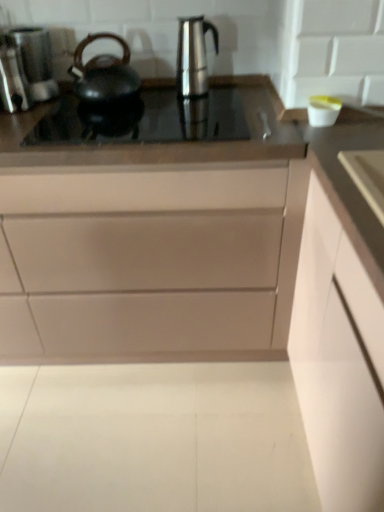
Question: Is satin nickel faucet at center bigger or smaller than matte white drawer at center, which is counted as the 1th cabinetry, starting from the left?

Choices:
 (A) small
 (B) big

Answer: (A)

Question: In terms of width, does satin nickel faucet at center look wider or thinner when compared to matte white drawer at center, which is counted as the 1th cabinetry, starting from the left?

Choices:
 (A) wide
 (B) thin

Answer: (B)

Question: Which object is positioned farthest from the matte white drawer at center, arranged as the 2th cabinetry when viewed from the right?

Choices:
 (A) black matte kettle at left
 (B) black glass cooktop at center
 (C) polished stainless steel coffee machine at left
 (D) stainless steel coffee pot at center
 (E) satin nickel faucet at center

Answer: (C)

Question: Considering the real-world distances, which object is closest to the black matte kettle at left?

Choices:
 (A) satin nickel faucet at center
 (B) white matte cabinet at right, which is counted as the 1th cabinetry, starting from the right
 (C) polished stainless steel coffee machine at left
 (D) matte white drawer at center, arranged as the 2th cabinetry when viewed from the right
 (E) stainless steel coffee pot at center

Answer: (C)